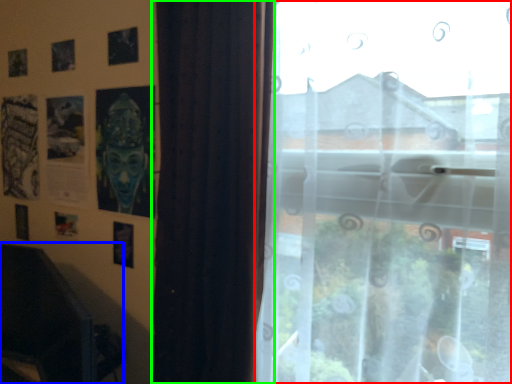
Question: Which object is positioned closest to window (highlighted by a red box)? Select from swivel chair (highlighted by a blue box) and curtain (highlighted by a green box).

Choices:
 (A) swivel chair
 (B) curtain

Answer: (B)